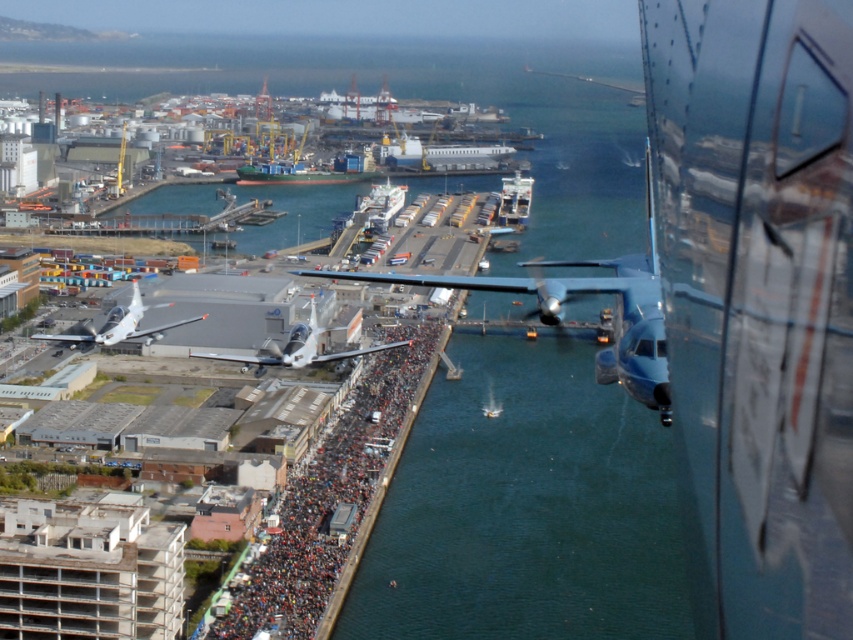
Measure the distance from green water at center to metallic blue airplane at center.

green water at center is 77.92 meters from metallic blue airplane at center.

Does green water at center appear on the right side of metallic blue airplane at center?

No, green water at center is not to the right of metallic blue airplane at center.

Does point (524, 372) come in front of point (534, 308)?

Yes, it is in front of point (534, 308).

At what (x,y) coordinates should I click in order to perform the action: click on green water at center. Please return your answer as a coordinate pair (x, y). This screenshot has height=640, width=853. Looking at the image, I should click on (526, 508).

Is the position of white glossy airplane at center more distant than that of silver metallic airplane at lower left?

No, white glossy airplane at center is in front of silver metallic airplane at lower left.

From the picture: Who is shorter, white glossy airplane at center or silver metallic airplane at lower left?

silver metallic airplane at lower left is shorter.

Which is in front, point (256, 374) or point (120, 317)?

Point (256, 374) is in front.

Find the location of a particular element. white glossy airplane at center is located at coordinates (296, 348).

Is point (328, 484) positioned in front of point (294, 365)?

That is True.

Who is taller, dark gray concrete crowd at center or white glossy airplane at center?

dark gray concrete crowd at center

I want to click on dark gray concrete crowd at center, so click(328, 500).